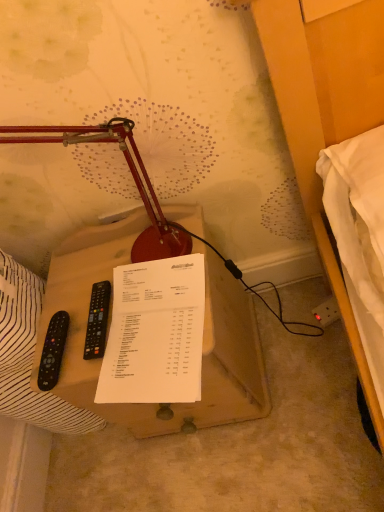
Where is `vacant space behind black plastic remote control at left, which is the 1th remote control in right-to-left order`? vacant space behind black plastic remote control at left, which is the 1th remote control in right-to-left order is located at coordinates (x=82, y=280).